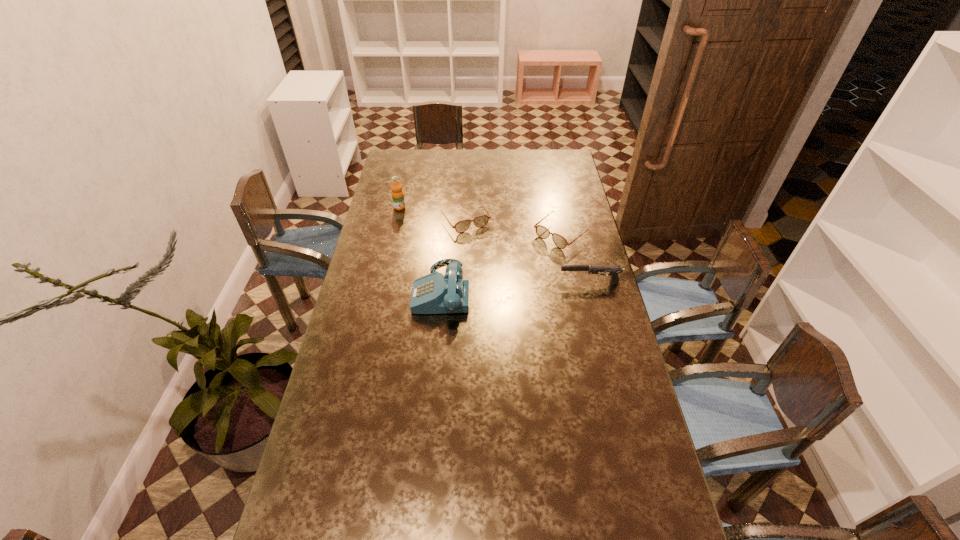
This screenshot has height=540, width=960. Find the location of `vacant space on the desktop that is between the fourth shortest object and the gun and is positioned on the front-facing side of the left sunglasses`. vacant space on the desktop that is between the fourth shortest object and the gun and is positioned on the front-facing side of the left sunglasses is located at coordinates (511, 286).

Locate an element on the screen. The image size is (960, 540). vacant space on the desktop that is between the telephone and the gun and is positioned on the label of the orange juice is located at coordinates (516, 286).

Find the location of a particular element. The height and width of the screenshot is (540, 960). vacant spot on the desktop that is between the fourth shortest object and the gun and is positioned on the front-facing side of the right sunglasses is located at coordinates (495, 287).